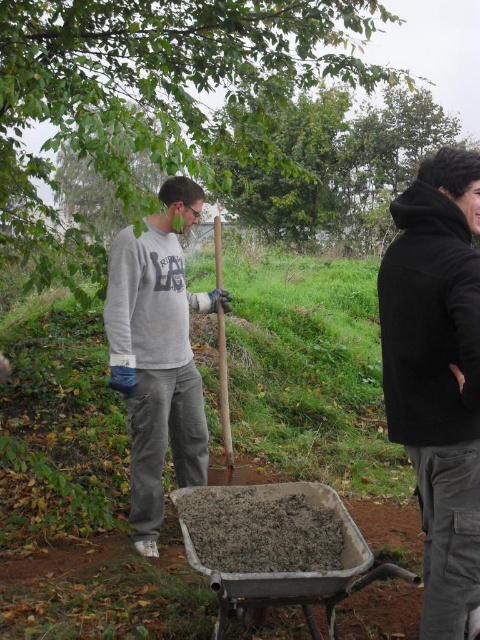
Is green leafy tree at upper left behind gray cotton sweatshirt at center?

No, it is in front of gray cotton sweatshirt at center.

In the scene shown: Between green leafy tree at upper left and gray cotton sweatshirt at center, which one has more height?

Standing taller between the two is green leafy tree at upper left.

The image size is (480, 640). What do you see at coordinates (156, 100) in the screenshot?
I see `green leafy tree at upper left` at bounding box center [156, 100].

Locate an element on the screen. The height and width of the screenshot is (640, 480). green leafy tree at upper left is located at coordinates (156, 100).

Between gray concrete cart at center and wooden shovel at center, which one is positioned higher?

Positioned higher is wooden shovel at center.

I want to click on gray concrete cart at center, so click(x=277, y=545).

This screenshot has height=640, width=480. Describe the element at coordinates (156, 100) in the screenshot. I see `green leafy tree at upper left` at that location.

Between green leafy tree at upper left and wooden shovel at center, which one appears on the left side from the viewer's perspective?

From the viewer's perspective, green leafy tree at upper left appears more on the left side.

Identify the location of green leafy tree at upper left. This screenshot has height=640, width=480. (156, 100).

The height and width of the screenshot is (640, 480). Identify the location of green leafy tree at upper left. (156, 100).